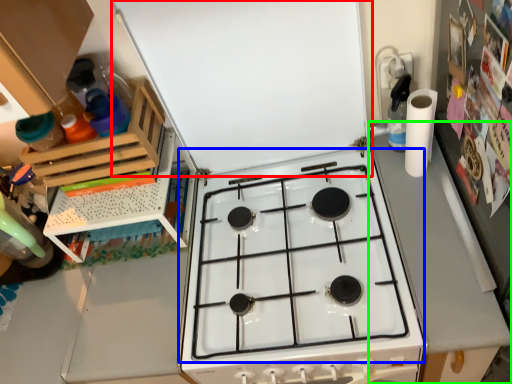
Question: Which object is positioned farthest from exhaust hood (highlighted by a red box)? Select from gas stove (highlighted by a blue box) and counter top (highlighted by a green box).

Choices:
 (A) gas stove
 (B) counter top

Answer: (B)